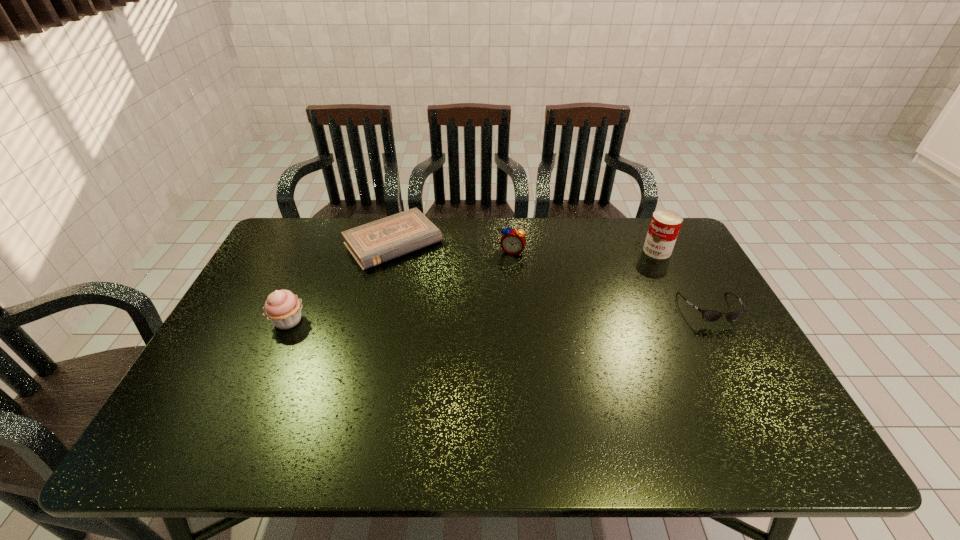
Find the location of `object present at the left edge`. object present at the left edge is located at coordinates (283, 308).

Locate an element on the screen. sunglasses located in the right edge section of the desktop is located at coordinates (708, 315).

Locate an element on the screen. The width and height of the screenshot is (960, 540). can situated at the right edge is located at coordinates (665, 224).

You are a GUI agent. You are given a task and a screenshot of the screen. Output one action in this format:
    pyautogui.click(x=<x>, y=<y>)
    Task: Click on the object located at the far right corner
    
    Given the screenshot: What is the action you would take?
    pyautogui.click(x=665, y=224)

In the image, there is a desktop. Where is `vacant space at the far edge`? Image resolution: width=960 pixels, height=540 pixels. vacant space at the far edge is located at coordinates (561, 259).

Where is `free space at the near edge`? The image size is (960, 540). free space at the near edge is located at coordinates (392, 395).

The image size is (960, 540). I want to click on vacant region at the left edge, so click(x=304, y=268).

Identify the location of free space at the right edge of the desktop. (721, 323).

Where is `vacant area at the far left corner`? vacant area at the far left corner is located at coordinates (331, 224).

Locate an element on the screen. The width and height of the screenshot is (960, 540). free space between the fourth tallest object and the leftmost object is located at coordinates (499, 315).